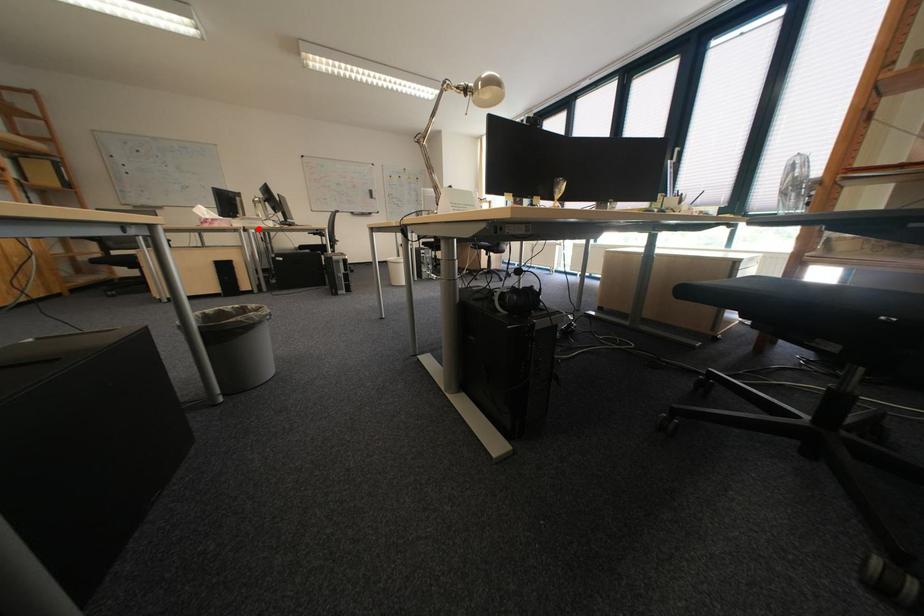
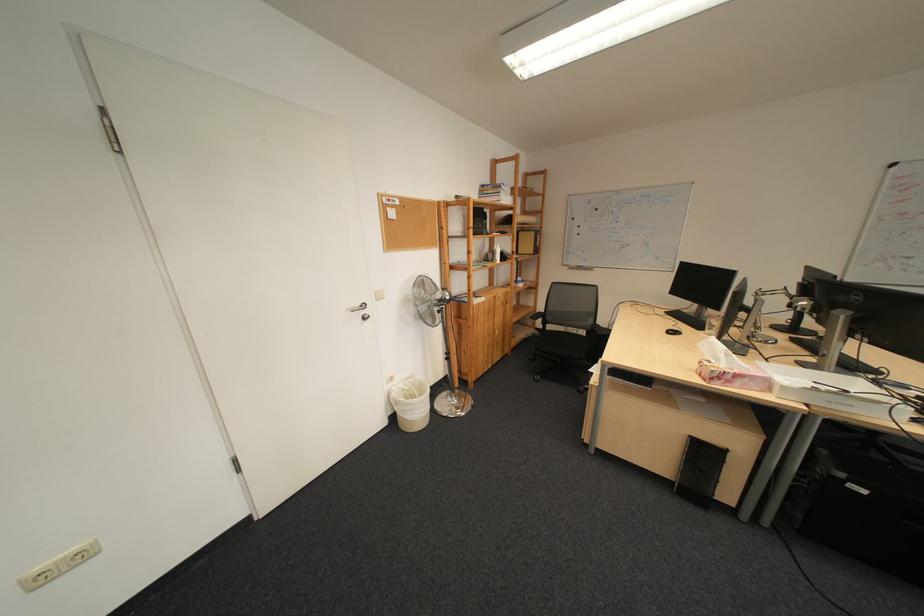
The point at the highlighted location is marked in the first image. Where is the corresponding point in the second image?

(821, 407)